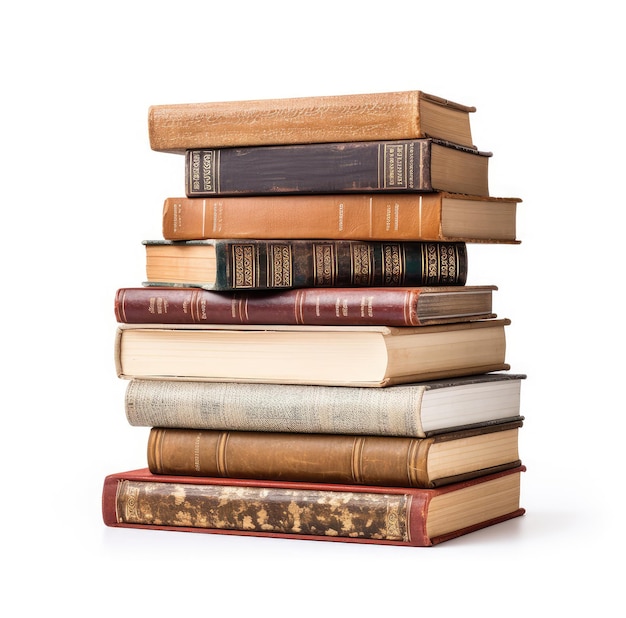
You are a GUI agent. You are given a task and a screenshot of the screen. Output one action in this format:
    pyautogui.click(x=<x>, y=<y>)
    Task: Click on the books
    This screenshot has height=618, width=626.
    Given the screenshot: What is the action you would take?
    pyautogui.click(x=317, y=508), pyautogui.click(x=352, y=442), pyautogui.click(x=375, y=408), pyautogui.click(x=342, y=360), pyautogui.click(x=329, y=302), pyautogui.click(x=300, y=261), pyautogui.click(x=330, y=221), pyautogui.click(x=371, y=178), pyautogui.click(x=381, y=117)